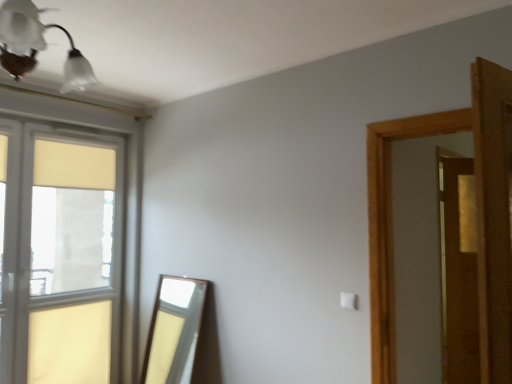
Question: Is white glass light fixture at upper left shorter than matte glass window at left?

Choices:
 (A) yes
 (B) no

Answer: (A)

Question: Does white glass light fixture at upper left lie in front of matte glass window at left?

Choices:
 (A) no
 (B) yes

Answer: (B)

Question: Is white glass light fixture at upper left facing away from matte glass window at left?

Choices:
 (A) yes
 (B) no

Answer: (B)

Question: From a real-world perspective, is white glass light fixture at upper left located beneath matte glass window at left?

Choices:
 (A) no
 (B) yes

Answer: (A)

Question: Is white glass light fixture at upper left completely or partially outside of matte glass window at left?

Choices:
 (A) yes
 (B) no

Answer: (A)

Question: Could you tell me if white glass light fixture at upper left is facing matte glass window at left?

Choices:
 (A) yes
 (B) no

Answer: (B)

Question: Can you confirm if matte glass window at left is thinner than white glass light fixture at upper left?

Choices:
 (A) yes
 (B) no

Answer: (A)

Question: Is matte glass window at left taller than white glass light fixture at upper left?

Choices:
 (A) no
 (B) yes

Answer: (B)

Question: From the image's perspective, is matte glass window at left above white glass light fixture at upper left?

Choices:
 (A) no
 (B) yes

Answer: (A)

Question: Does matte glass window at left appear on the right side of white glass light fixture at upper left?

Choices:
 (A) no
 (B) yes

Answer: (A)

Question: Is white glass light fixture at upper left completely or partially inside matte glass window at left?

Choices:
 (A) yes
 (B) no

Answer: (B)

Question: Are matte glass window at left and white glass light fixture at upper left located far from each other?

Choices:
 (A) yes
 (B) no

Answer: (B)

Question: From the image's perspective, is wooden door at right above matte glass window at left?

Choices:
 (A) no
 (B) yes

Answer: (B)